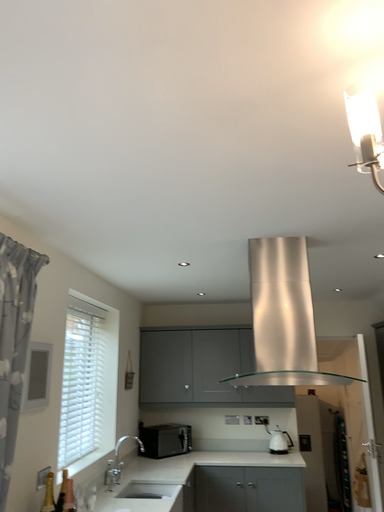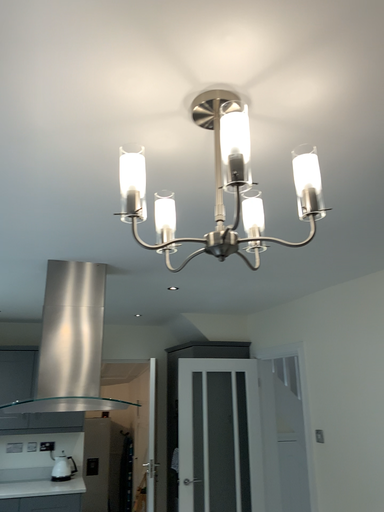
Question: Which way did the camera rotate in the video?

Choices:
 (A) rotated right
 (B) rotated left

Answer: (A)